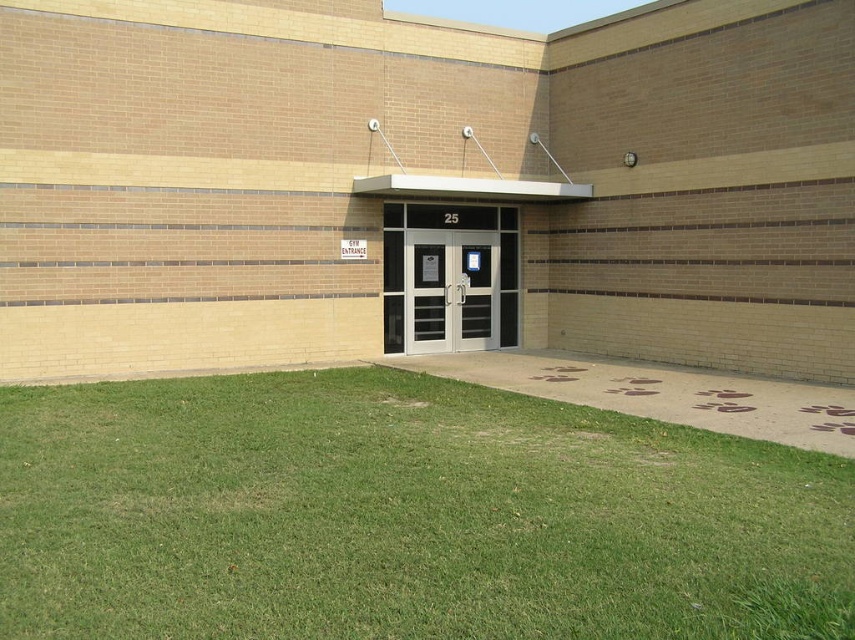
You are a delivery person trying to enter the gym with a large package. The white glass door at center and the matte black door at center are both in front of you. Which door should you choose to ensure your package will fit through?

The white glass door at center is wider than the matte black door at center, so you should choose the white glass door at center to ensure your package will fit through.

You are standing at the entrance of the building and want to take a photo that includes both the point at coordinates point [447,262] and point [458,250]. Which point should you focus on to ensure both are in sharp focus?

You should focus on point [447,262] because it is closer to the camera than point [458,250], ensuring both are within the depth of field.

You are a visitor approaching the building and want to enter the gym. You see the white glass doors at center and the matte black door at center. Which door should you use to enter the gym?

The white glass doors at center is above the matte black door at center, so the matte black door at center is the actual entrance. Use the matte black door at center to enter the gym.